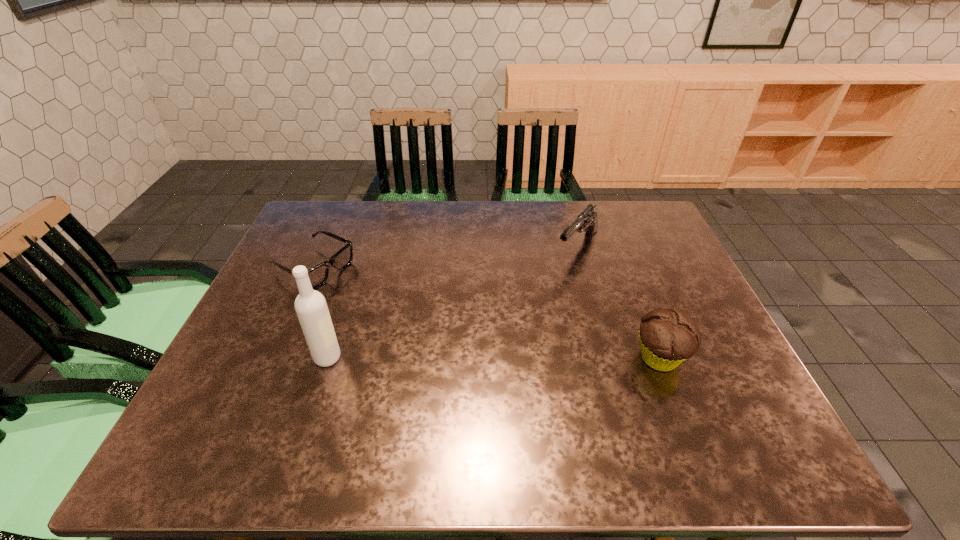
Identify the location of vacant region located on the front-facing side of the shortest object. The width and height of the screenshot is (960, 540). (449, 339).

In order to click on vacant space situated 0.380m on the front-facing side of the shortest object in this screenshot , I will do `click(452, 341)`.

Find the location of a particular element. object present at the far edge is located at coordinates (587, 221).

This screenshot has height=540, width=960. I want to click on object at the near edge, so click(x=668, y=337).

The width and height of the screenshot is (960, 540). Identify the location of object located in the left edge section of the desktop. (318, 275).

In order to click on object that is at the right edge in this screenshot , I will do `click(668, 337)`.

Find the location of a particular element. The height and width of the screenshot is (540, 960). object located in the near right corner section of the desktop is located at coordinates (668, 337).

This screenshot has height=540, width=960. Find the location of `free space at the far edge of the desktop`. free space at the far edge of the desktop is located at coordinates (553, 209).

In order to click on vacant space at the near edge of the desktop in this screenshot , I will do `click(291, 392)`.

Locate an element on the screen. This screenshot has width=960, height=540. free space at the far left corner of the desktop is located at coordinates (331, 218).